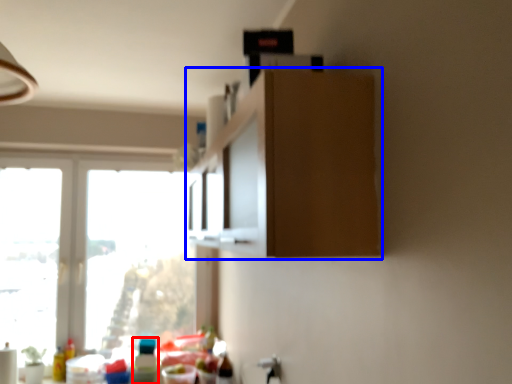
Question: Which of the following is the closest to the observer, bottle (highlighted by a red box) or cabinetry (highlighted by a blue box)?

Choices:
 (A) bottle
 (B) cabinetry

Answer: (B)